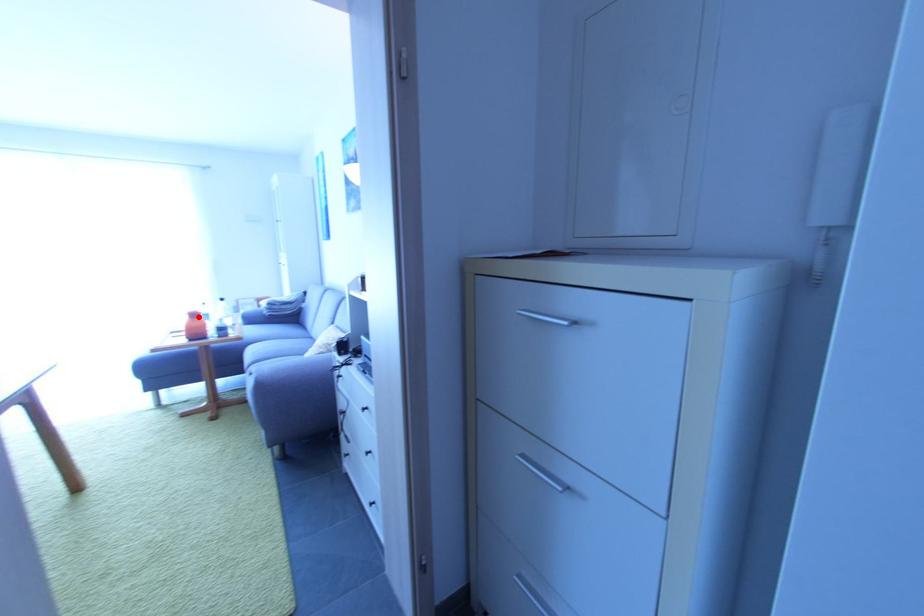
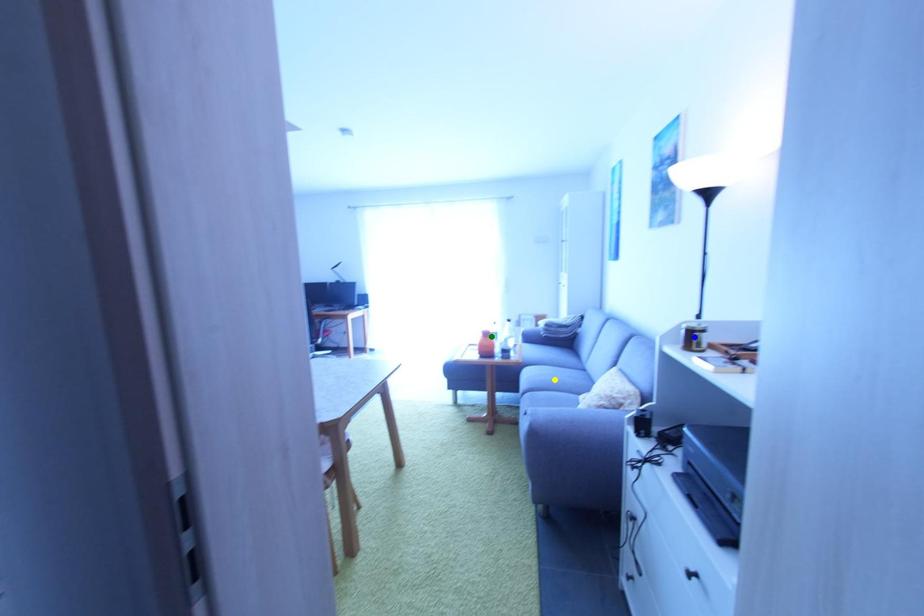
Question: I am providing you with two images of the same scene from different viewpoints. A red point is marked on the first image. You are given multiple points on the second image. Which point in image 2 represents the same 3d spot as the red point in image 1?

Choices:
 (A) yellow point
 (B) blue point
 (C) green point

Answer: (C)